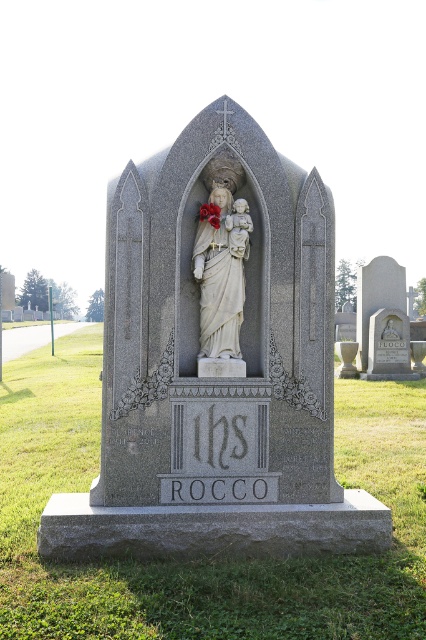
Question: Does gray stone statue at center appear on the left side of white marble statue at center?

Choices:
 (A) yes
 (B) no

Answer: (B)

Question: Where is gray stone statue at center located in relation to white marble statue at center in the image?

Choices:
 (A) left
 (B) right

Answer: (B)

Question: Does gray stone statue at center have a smaller size compared to white marble statue at center?

Choices:
 (A) no
 (B) yes

Answer: (A)